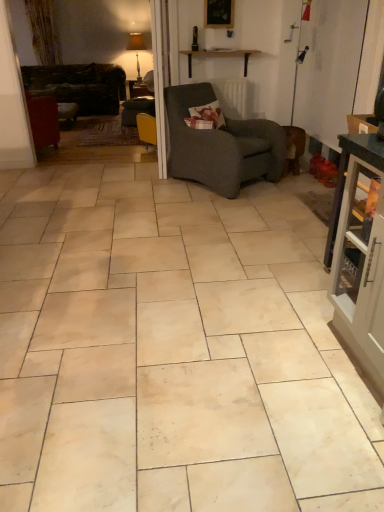
Question: Based on their sizes in the image, would you say matte gray cabinet at right is bigger or smaller than dark gray textured armchair at center?

Choices:
 (A) small
 (B) big

Answer: (A)

Question: From the image's perspective, relative to dark gray textured armchair at center, is matte gray cabinet at right above or below?

Choices:
 (A) below
 (B) above

Answer: (A)

Question: Which object is the closest to the dark gray textured armchair at center?

Choices:
 (A) matte white lampshade at upper center
 (B) dark brown leather couch at left
 (C) wooden picture frame at upper center
 (D) matte gray cabinet at right
 (E) floral fabric pillow at center

Answer: (E)

Question: Which of these objects is positioned farthest from the beige marble tile at center?

Choices:
 (A) floral fabric pillow at center
 (B) matte white lampshade at upper center
 (C) wooden picture frame at upper center
 (D) dark gray textured armchair at center
 (E) dark brown leather couch at left

Answer: (B)